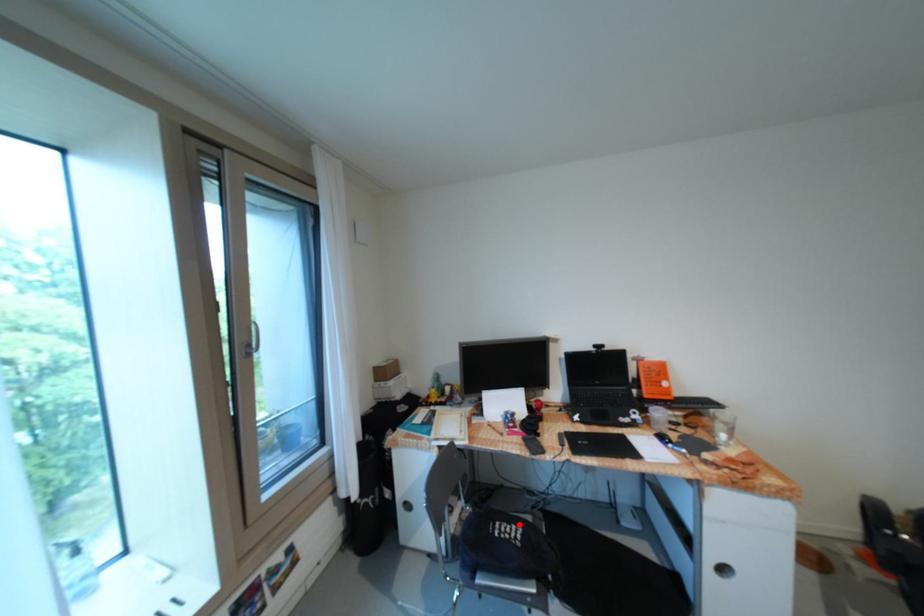
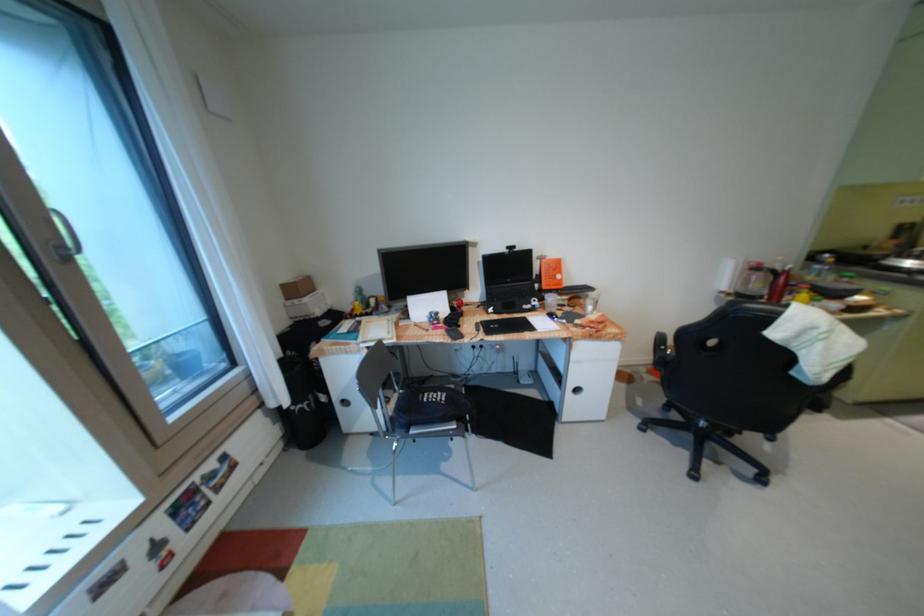
Question: I am providing you with two images of the same scene from different viewpoints. A red point is marked on the first image. Can you still see the location of the red point in image 2?

Choices:
 (A) Yes
 (B) No

Answer: (A)